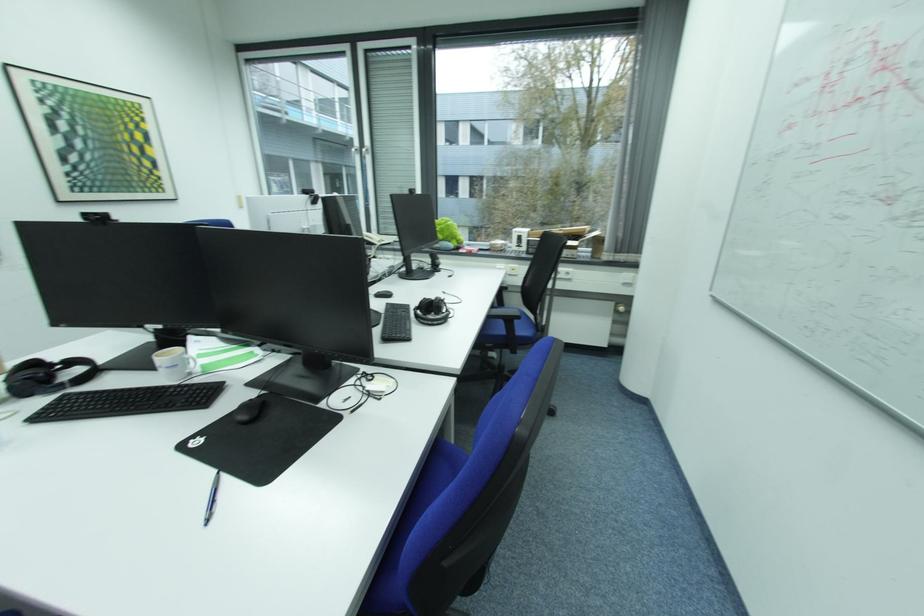
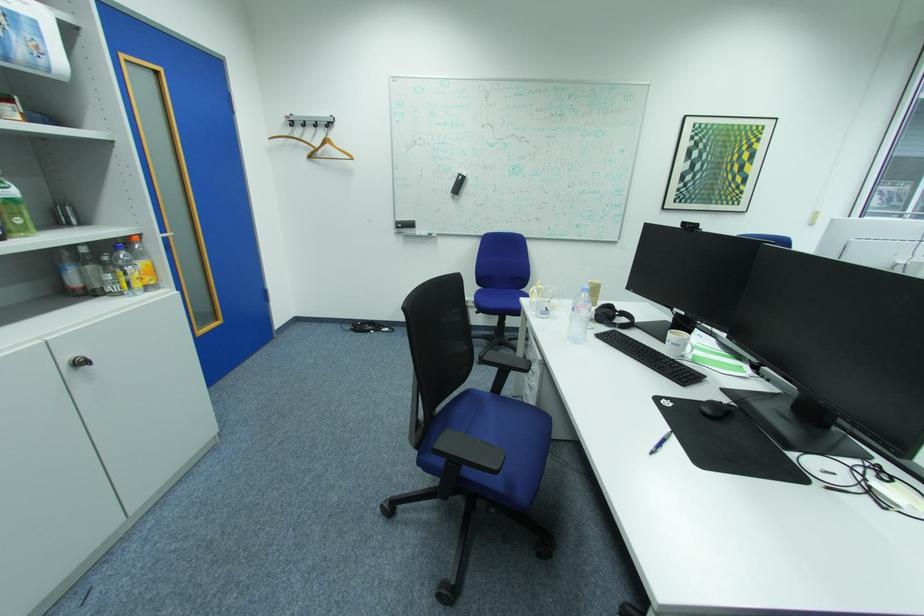
Question: The first image is from the beginning of the video and the second image is from the end. How did the camera likely rotate when shooting the video?

Choices:
 (A) Left
 (B) Right
 (C) Up
 (D) Down

Answer: (A)